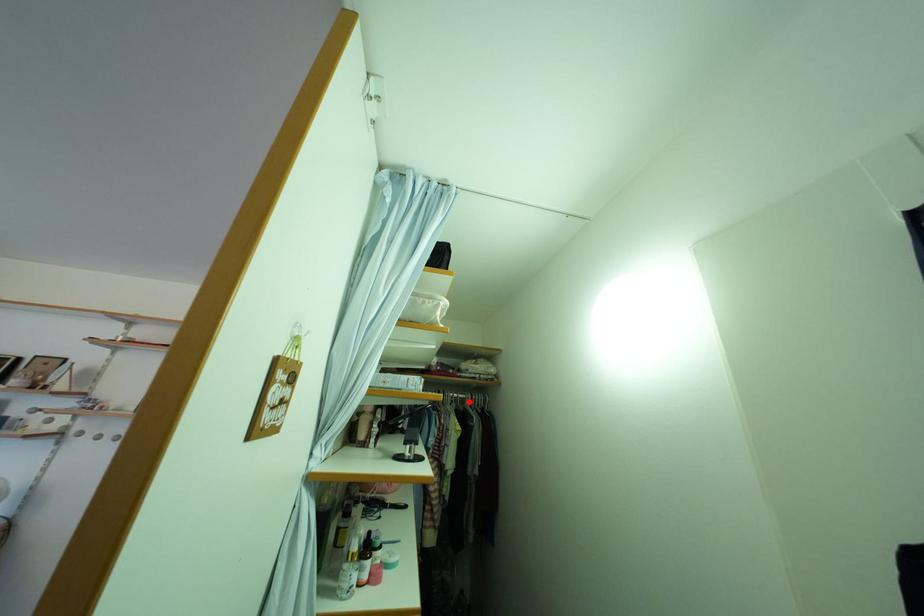
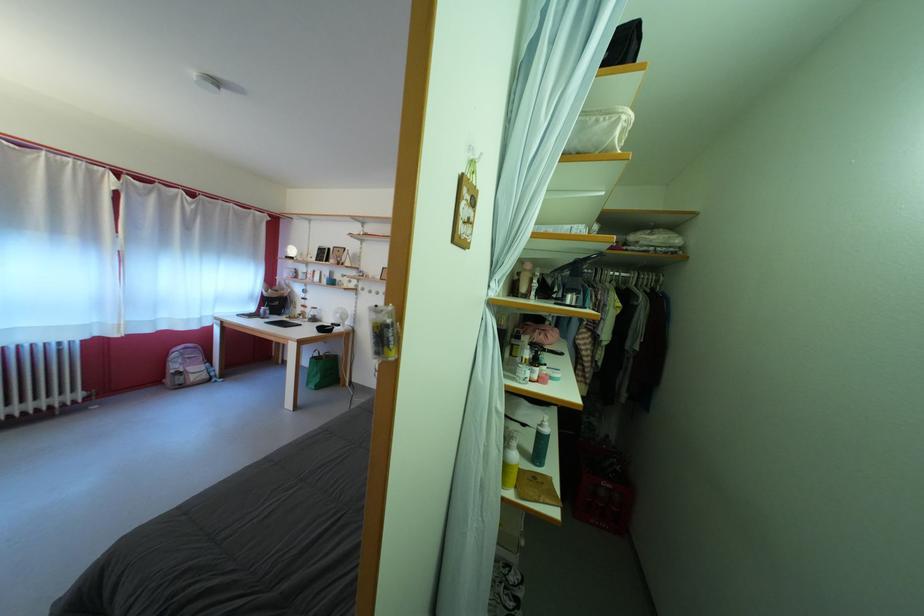
In the second image, find the point that corresponds to the highlighted location in the first image.

(631, 281)